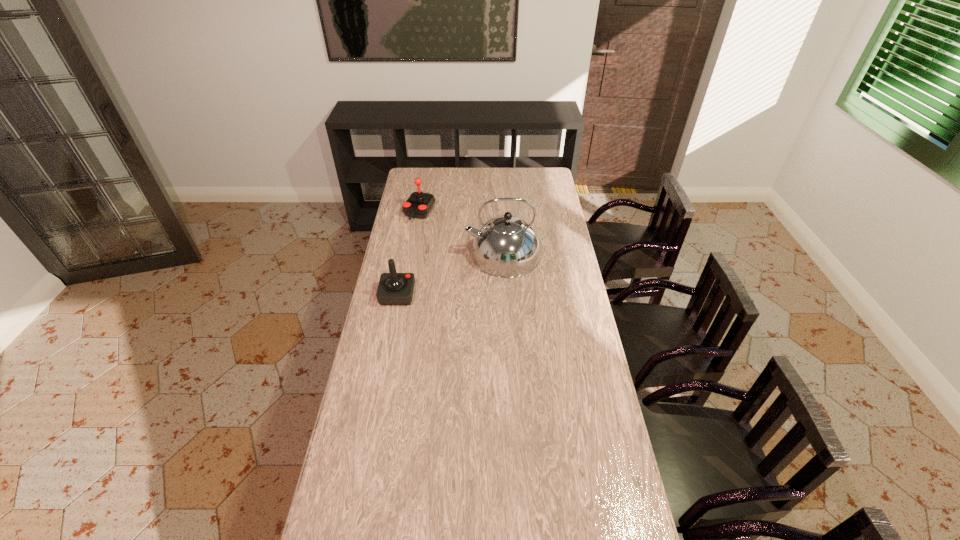
This screenshot has width=960, height=540. Identify the location of the tallest object. (506, 246).

This screenshot has width=960, height=540. What are the coordinates of `the rightmost object` in the screenshot? It's located at (506, 246).

Identify the location of the nearest object. The height and width of the screenshot is (540, 960). (394, 288).

In order to click on the farthest object in this screenshot , I will do `click(419, 204)`.

Identify the location of blank area located from the spout of the kettle. (440, 255).

Where is `vacant space situated from the spout of the kettle`? The height and width of the screenshot is (540, 960). vacant space situated from the spout of the kettle is located at coordinates (442, 255).

Where is `free space located from the spout of the kettle`? The height and width of the screenshot is (540, 960). free space located from the spout of the kettle is located at coordinates (445, 255).

Locate an element on the screen. The height and width of the screenshot is (540, 960). free region located 0.300m on the front-facing side of the nearer joystick is located at coordinates (485, 295).

What are the coordinates of `free region located on the right of the farthest object` in the screenshot? It's located at (494, 212).

The width and height of the screenshot is (960, 540). Find the location of `object present at the right edge`. object present at the right edge is located at coordinates (506, 246).